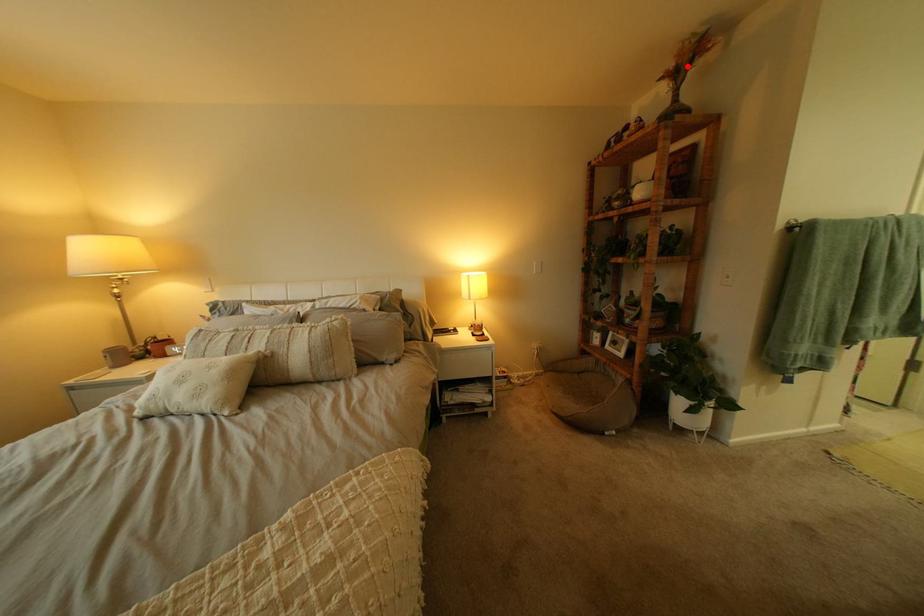
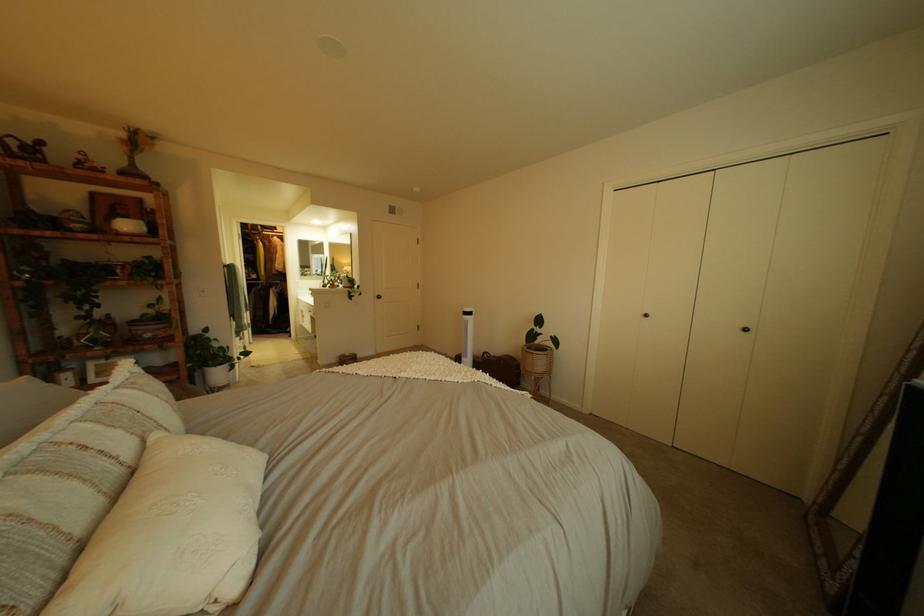
Find the pixel in the second image that matches the highlighted location in the first image.

(139, 137)